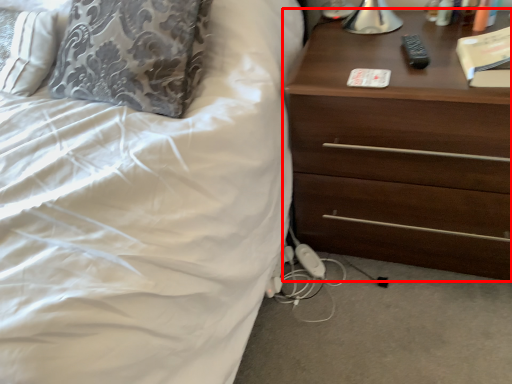
Question: Where is chest of drawers (annotated by the red box) located in relation to book in the image?

Choices:
 (A) left
 (B) right

Answer: (A)